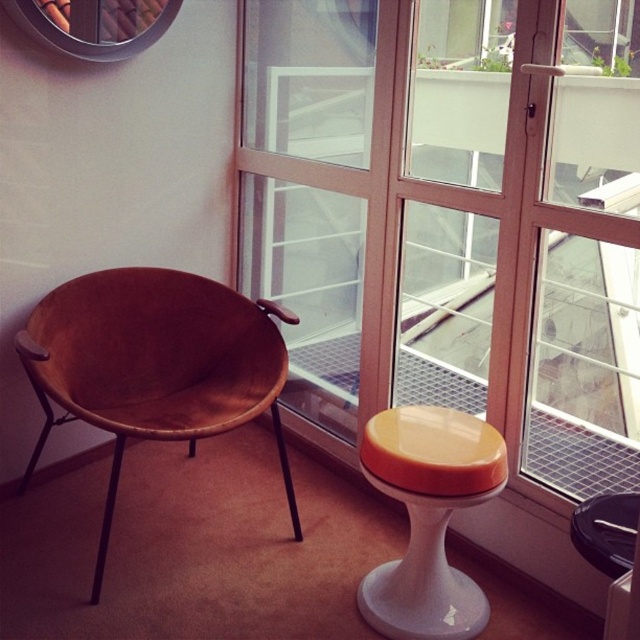
Is point (273, 52) farther from viewer compared to point (381, 436)?

Yes.

Measure the distance between point (266, 172) and camera.

Point (266, 172) and camera are 8.75 feet apart from each other.

You are a GUI agent. You are given a task and a screenshot of the screen. Output one action in this format:
    pyautogui.click(x=<x>, y=<y>)
    Task: Click on the transparent glass window at center
    
    Given the screenshot: What is the action you would take?
    pyautogui.click(x=452, y=218)

Is point (173, 378) closer to viewer compared to point (500, 460)?

That is False.

Does brown leather swivel chair at left have a lesser width compared to orange glossy stool at lower right?

No.

Is point (173, 397) more distant than point (486, 612)?

Yes, point (173, 397) is farther from viewer.

Identify the location of brown leather swivel chair at left. (154, 364).

Can you confirm if transparent glass window at center is positioned to the left of brown leather swivel chair at left?

In fact, transparent glass window at center is to the right of brown leather swivel chair at left.

Between transparent glass window at center and brown leather swivel chair at left, which one has less height?

Standing shorter between the two is brown leather swivel chair at left.

Which is in front, point (637, 189) or point (113, 476)?

Point (637, 189)

At what (x,y) coordinates should I click in order to perform the action: click on transparent glass window at center. Please return your answer as a coordinate pair (x, y). The height and width of the screenshot is (640, 640). Looking at the image, I should click on (452, 218).